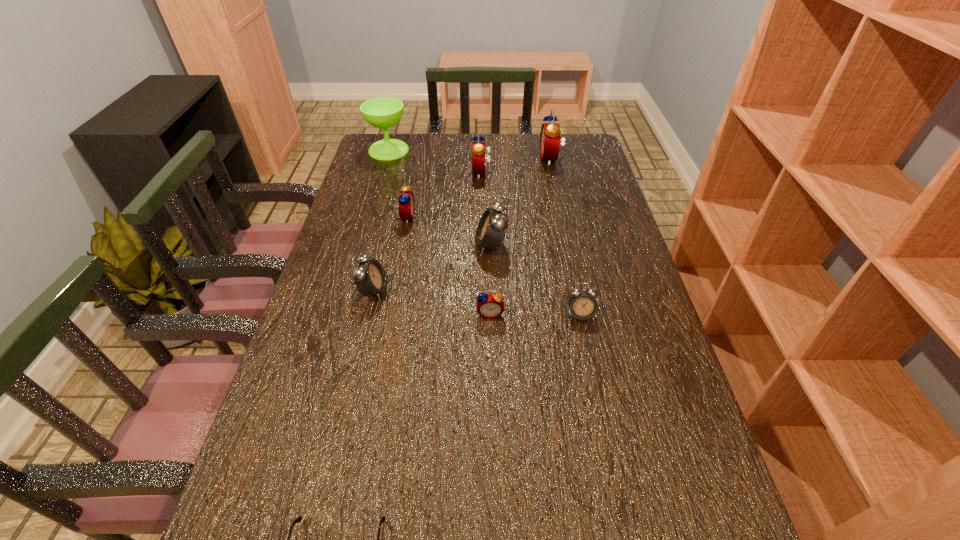
Locate an element on the screen. free space located 0.280m on the face of the farthest white alarm clock is located at coordinates (378, 246).

I want to click on blank space located 0.090m on the face of the farthest white alarm clock, so click(x=444, y=246).

The width and height of the screenshot is (960, 540). Find the location of `free space located on the face of the farthest white alarm clock`. free space located on the face of the farthest white alarm clock is located at coordinates (371, 246).

I want to click on blank space located on the front-facing side of the leftmost red alarm clock, so pos(531,218).

Find the location of a particular element. vacant space located 0.180m on the face of the leftmost white alarm clock is located at coordinates (457, 291).

The height and width of the screenshot is (540, 960). Identify the location of vacant space situated on the front-facing side of the smallest red alarm clock. (492, 410).

You are a GUI agent. You are given a task and a screenshot of the screen. Output one action in this format:
    pyautogui.click(x=<x>, y=<y>)
    Task: Click on the vacant point located on the face of the smallest white alarm clock
    Image resolution: width=960 pixels, height=540 pixels.
    Given the screenshot: What is the action you would take?
    pyautogui.click(x=594, y=381)

The height and width of the screenshot is (540, 960). I want to click on wineglass present at the far edge, so click(384, 112).

I want to click on wineglass positioned at the left edge, so point(384,112).

The height and width of the screenshot is (540, 960). Identify the location of alarm clock that is at the left edge. (370, 279).